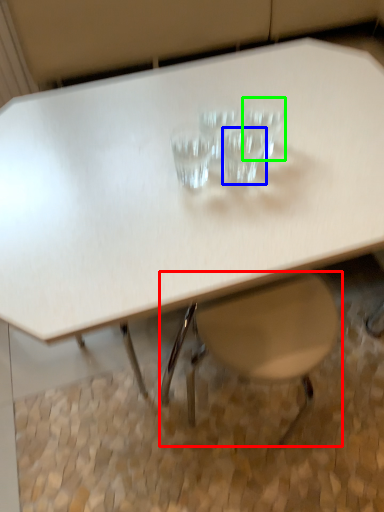
Question: Based on their relative distances, which object is farther from swivel chair (highlighted by a red box)? Choose from martini glass (highlighted by a blue box) and martini glass (highlighted by a green box).

Choices:
 (A) martini glass
 (B) martini glass

Answer: (B)